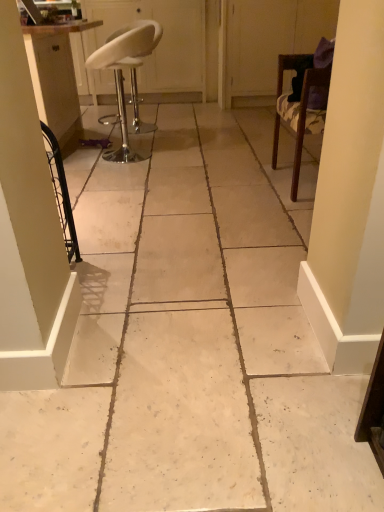
Identify the location of free space to the left of wooden chair at right, which is counted as the 2th chair, starting from the left. point(234,185).